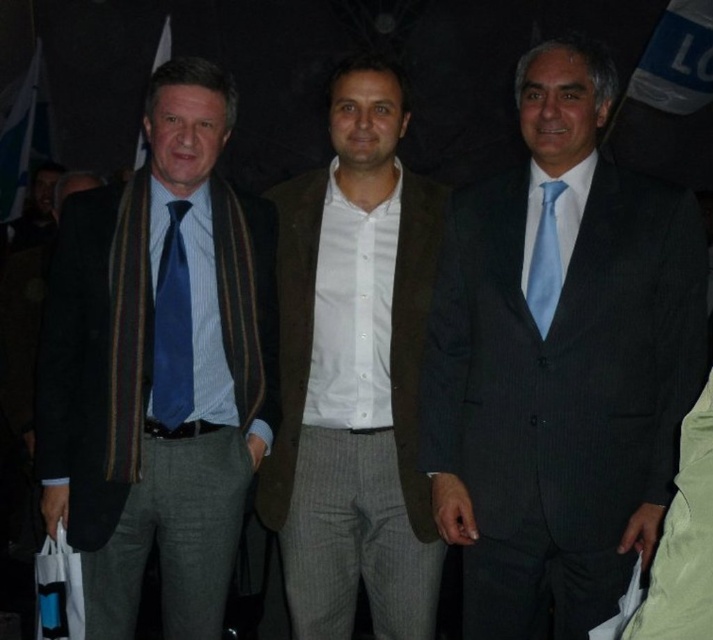
The width and height of the screenshot is (713, 640). Describe the element at coordinates (159, 365) in the screenshot. I see `matte black suit at left` at that location.

You are a GUI agent. You are given a task and a screenshot of the screen. Output one action in this format:
    pyautogui.click(x=<x>, y=<y>)
    Task: Click on the matte black suit at left
    The height and width of the screenshot is (640, 713).
    Given the screenshot: What is the action you would take?
    pyautogui.click(x=159, y=365)

At what (x,y) coordinates should I click in order to perform the action: click on matte black suit at left. Please return your answer as a coordinate pair (x, y). Looking at the image, I should click on (159, 365).

Can you confirm if matte black suit at left is taller than blue silk tie at left?

Yes.

Is point (168, 92) behind point (160, 360)?

That is False.

Is point (205, 339) in front of point (173, 429)?

No, (205, 339) is further to viewer.

Find the location of a particular element. matte black suit at left is located at coordinates (159, 365).

Can you confirm if matte black suit at center is positioned above matte black suit at left?

Indeed, matte black suit at center is positioned over matte black suit at left.

Can you confirm if matte black suit at center is thinner than matte black suit at left?

No.

Where is `matte black suit at center`? matte black suit at center is located at coordinates (560, 365).

Identify the location of matte black suit at center. Image resolution: width=713 pixels, height=640 pixels. (560, 365).